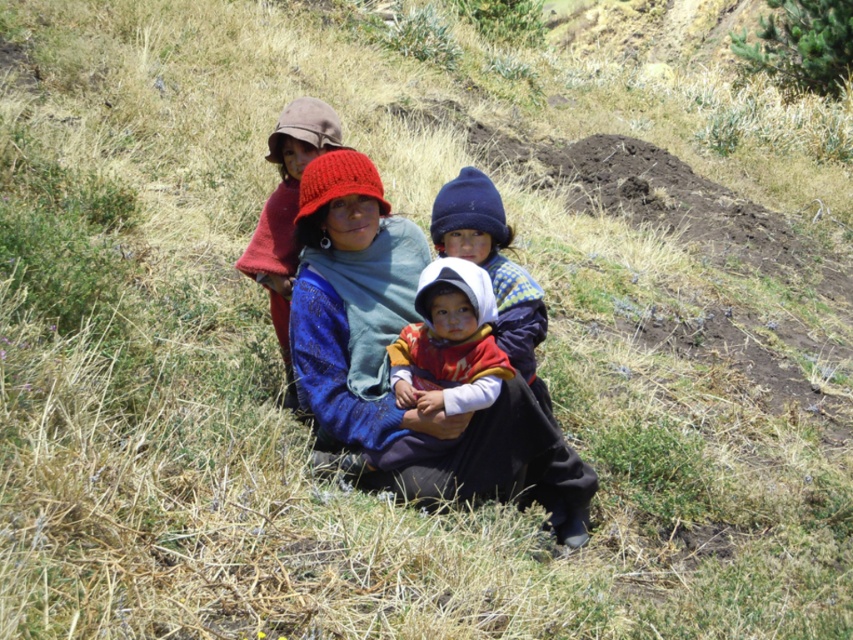
You are a photographer trying to capture a clear shot of the knitted wool hat at center without the multicolored woven cloth at center blocking it. What adjustment should you make to your camera position?

The multicolored woven cloth at center is in front of the knitted wool hat at center, so you should move your camera position backward to ensure the knitted wool hat at center is visible without obstruction.

You are a photographer setting up for a family photo on a grassy hillside. You have a camera with a 30 cm wide frame. The multicolored woven cloth at center and the knitted wool hat at center are both in the center of your view. Can both items fit within the frame if you position them side by side horizontally?

The multicolored woven cloth at center is wider than the knitted wool hat at center. Since the camera frame is 30 cm wide, the combined width of both items may exceed the frame. To ensure both fit, check their total width against the frame size.

What is located at the coordinates point (x=450, y=342) in the image?

The multicolored woven cloth at center is located at point (x=450, y=342).